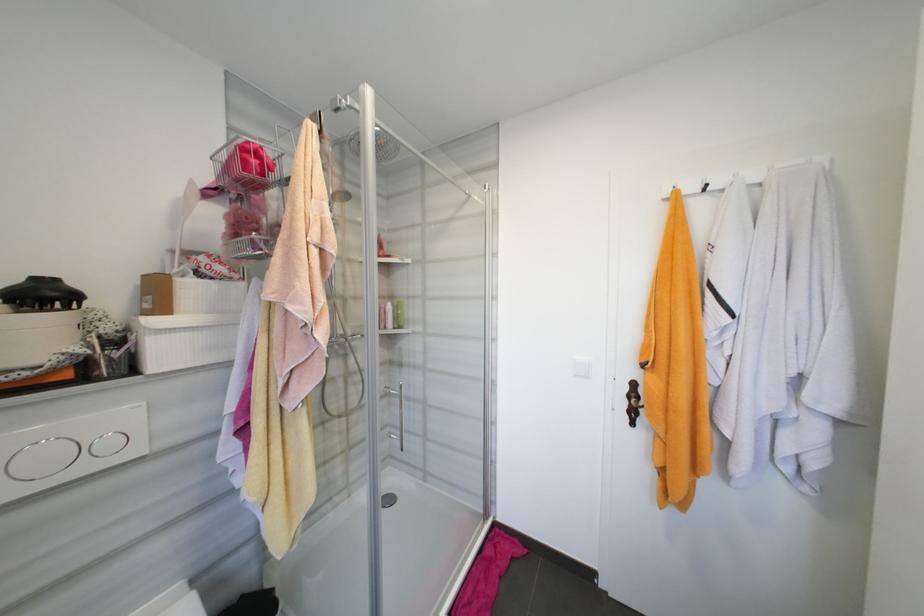
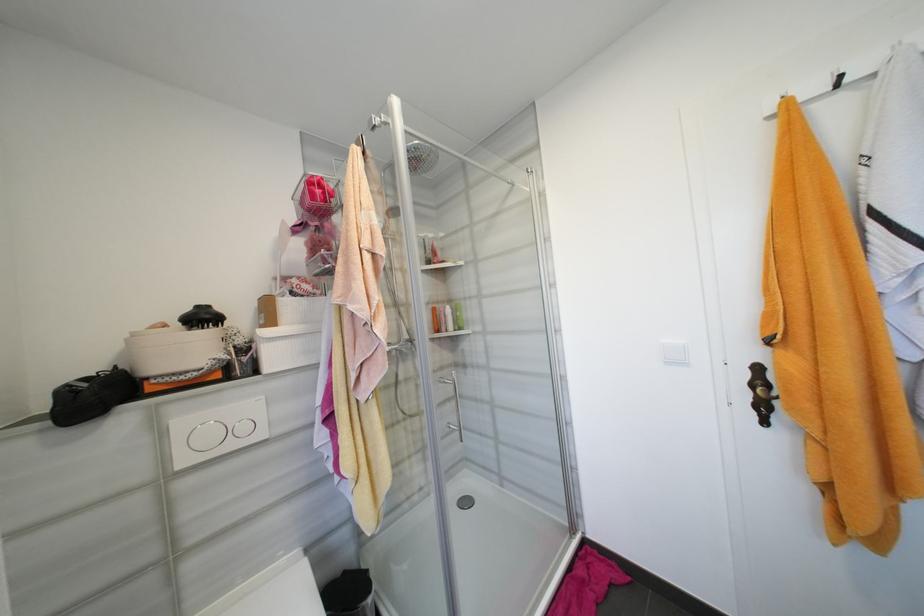
Find the pixel in the second image that matches (x=639, y=386) in the first image.

(763, 370)